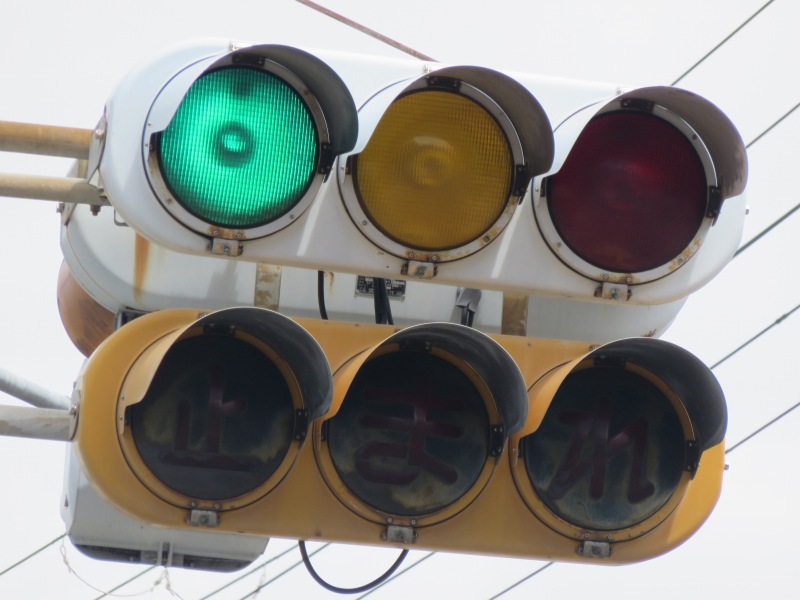
Locate an element on the screen. black cord is located at coordinates (401, 557).